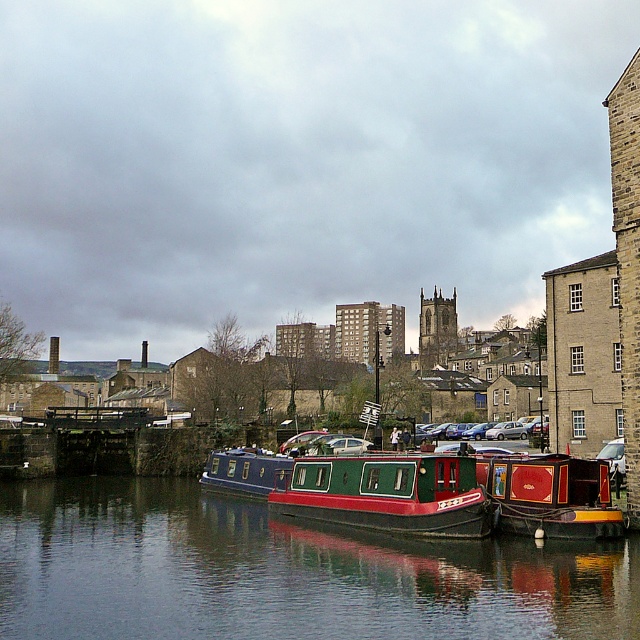
You are standing at the point with coordinates (387, 493) in the riverside scene. What object are you standing on?

You are standing on the red glossy barge at center.

You are standing at the riverside and want to take a photo of the smooth black water at center. According to the coordinates provided, where should you position your camera to capture it?

The smooth black water at center is located at point (x=282, y=572), so you should position your camera at that coordinate to capture it.